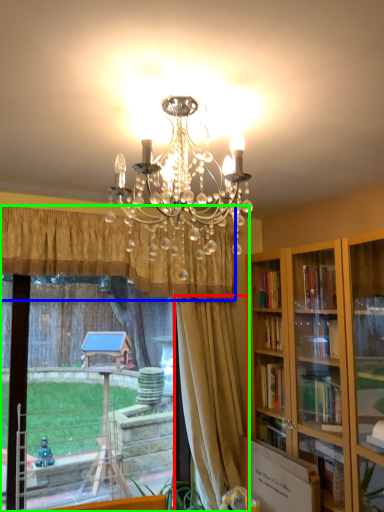
Question: Based on their relative distances, which object is nearer to curtain (highlighted by a red box)? Choose from curtain (highlighted by a blue box) and window (highlighted by a green box).

Choices:
 (A) curtain
 (B) window

Answer: (B)